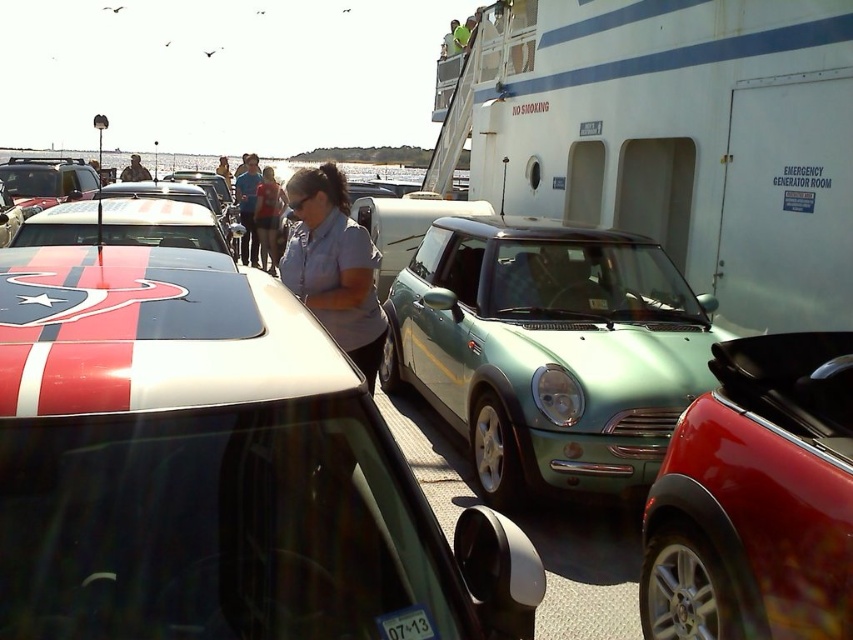
Question: Among these points, which one is nearest to the camera?

Choices:
 (A) (138, 173)
 (B) (381, 316)
 (C) (791, 554)

Answer: (C)

Question: Which object is positioned closest to the blue denim shirt at center?

Choices:
 (A) denim jacket at center
 (B) shiny red convertible at center

Answer: (A)

Question: Is shiny red convertible at center bigger than blue denim shirt at center?

Choices:
 (A) yes
 (B) no

Answer: (B)

Question: From the image, what is the correct spatial relationship of shiny red convertible at center in relation to blue denim shirt at center?

Choices:
 (A) left
 (B) right

Answer: (B)

Question: Considering the real-world distances, which object is farthest from the denim jacket at center?

Choices:
 (A) blue cotton shirt at center
 (B) green metallic car at center

Answer: (A)

Question: Can you confirm if blue denim shirt at center is bigger than matte black jacket at center?

Choices:
 (A) yes
 (B) no

Answer: (B)